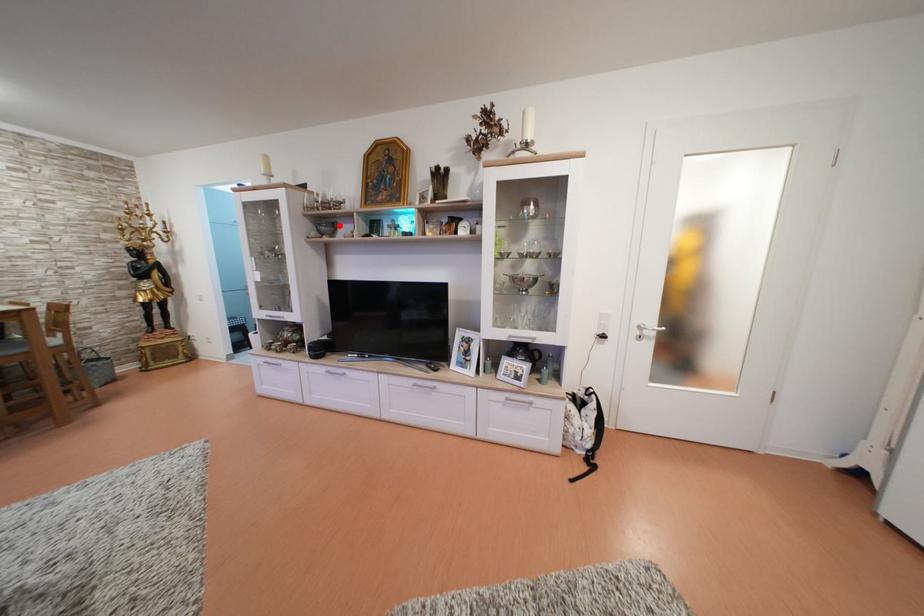
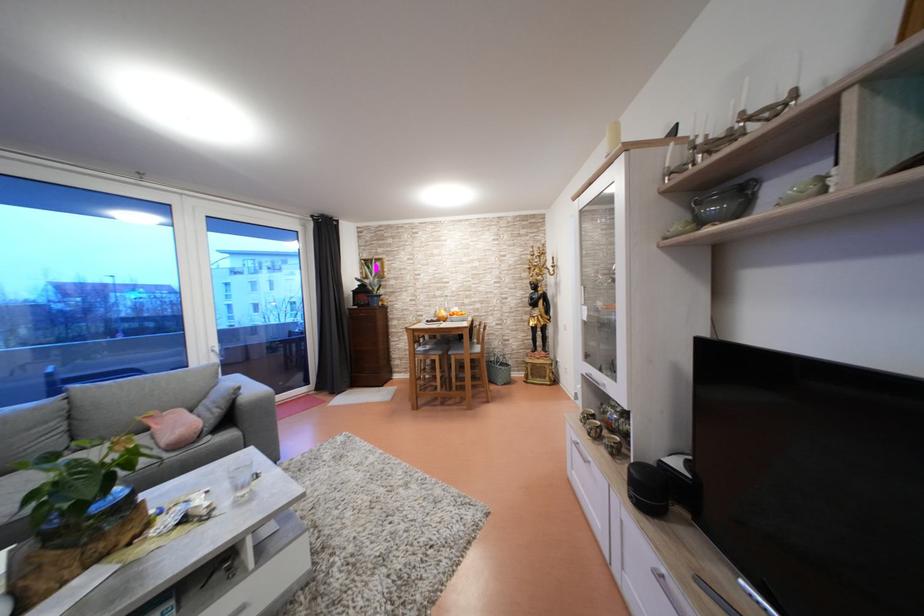
Question: A red point is marked in image1. In image2, is the corresponding 3D point closer to the camera or farther? Reply with the corresponding letter.

Choices:
 (A) The corresponding 3D point is closer.
 (B) The corresponding 3D point is farther.

Answer: (B)